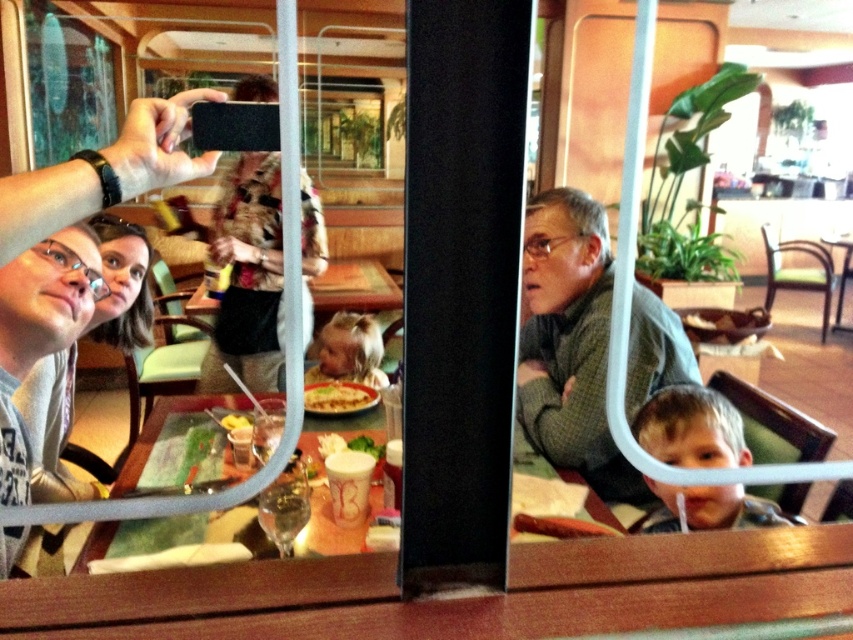
Is the position of blonde hair at center less distant than that of yellowish matte sandwich at center?

No.

Is blonde hair at center to the right of yellowish matte sandwich at center from the viewer's perspective?

Incorrect, blonde hair at center is not on the right side of yellowish matte sandwich at center.

Locate an element on the screen. The height and width of the screenshot is (640, 853). blonde hair at center is located at coordinates (349, 349).

Can you confirm if blonde hair at center is positioned to the left of yellow cheese at center?

Incorrect, blonde hair at center is not on the left side of yellow cheese at center.

Does blonde hair at center have a greater width compared to yellow cheese at center?

Correct, the width of blonde hair at center exceeds that of yellow cheese at center.

Based on the photo, who is more forward, (334, 337) or (234, 428)?

Point (234, 428)

This screenshot has height=640, width=853. I want to click on blonde hair at center, so click(349, 349).

In the scene shown: Between green textured sweater at center and yellow cheese at center, which one appears on the left side from the viewer's perspective?

Positioned to the left is yellow cheese at center.

Does green textured sweater at center have a larger size compared to yellow cheese at center?

Correct, green textured sweater at center is larger in size than yellow cheese at center.

Who is more distant from viewer, (538, 362) or (233, 417)?

The point (538, 362) is behind.

This screenshot has height=640, width=853. In order to click on green textured sweater at center in this screenshot , I will do `click(569, 342)`.